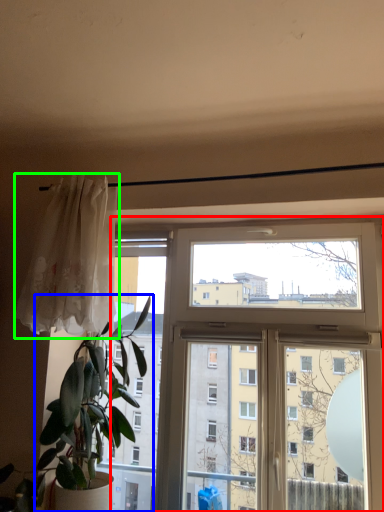
Question: Which object is positioned closest to window (highlighted by a red box)? Select from houseplant (highlighted by a blue box) and curtain (highlighted by a green box).

Choices:
 (A) houseplant
 (B) curtain

Answer: (A)